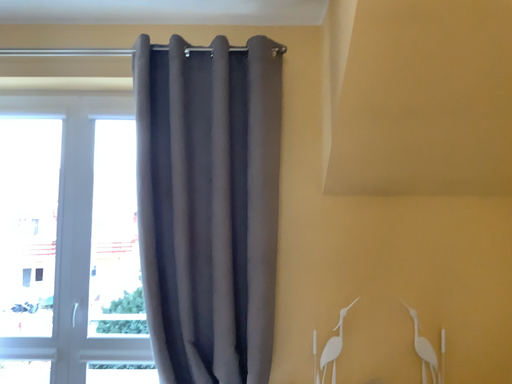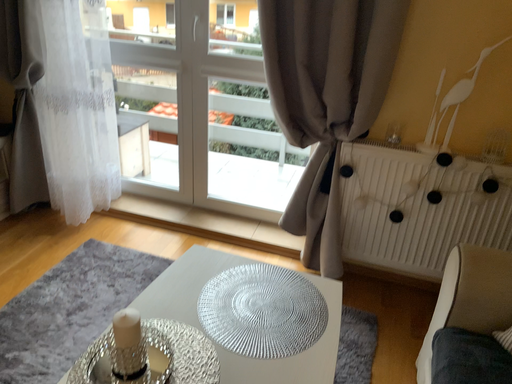
Question: How did the camera likely rotate when shooting the video?

Choices:
 (A) rotated upward
 (B) rotated downward

Answer: (B)